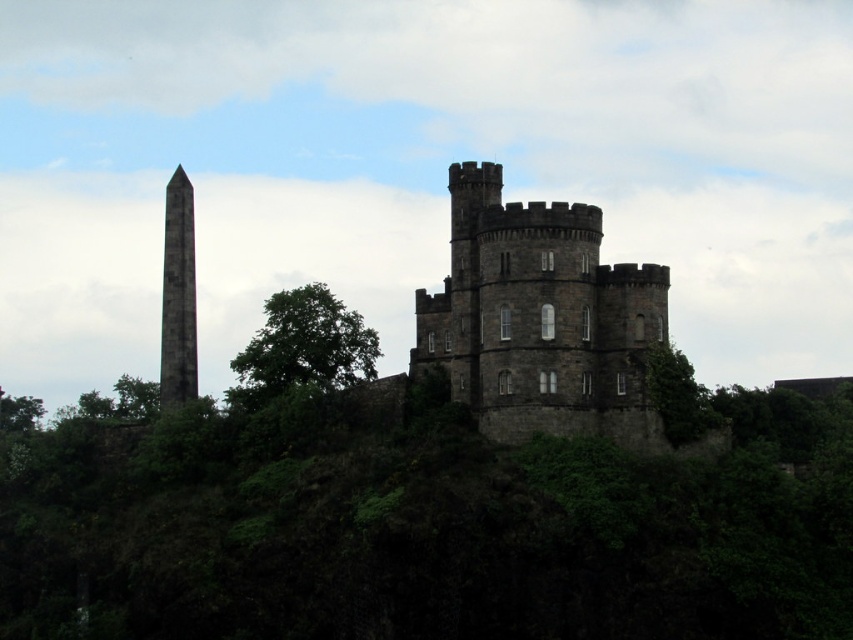
Question: Does dark stone castle at center have a greater width compared to green leafy tree at right?

Choices:
 (A) no
 (B) yes

Answer: (B)

Question: Is dark stone castle at center further to camera compared to granite obelisk at left?

Choices:
 (A) no
 (B) yes

Answer: (A)

Question: Among these objects, which one is farthest from the camera?

Choices:
 (A) green leafy tree at right
 (B) green leafy tree at center
 (C) granite obelisk at left
 (D) dark stone castle at center

Answer: (C)

Question: Which of these objects is positioned closest to the green leafy tree at right?

Choices:
 (A) dark stone castle at center
 (B) green leafy tree at center

Answer: (A)

Question: Among these objects, which one is nearest to the camera?

Choices:
 (A) green leafy tree at center
 (B) granite obelisk at left
 (C) green leafy tree at right

Answer: (C)

Question: Can you confirm if granite obelisk at left is positioned below green leafy tree at right?

Choices:
 (A) yes
 (B) no

Answer: (B)